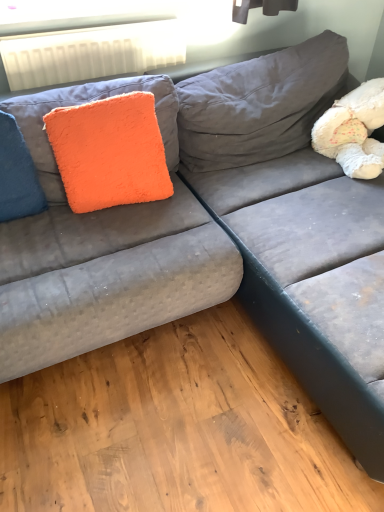
Question: From the image's perspective, is white fluffy teddy bear at upper right located above or below blue fuzzy pillow at left?

Choices:
 (A) above
 (B) below

Answer: (A)

Question: Is white fluffy teddy bear at upper right inside or outside of blue fuzzy pillow at left?

Choices:
 (A) outside
 (B) inside

Answer: (A)

Question: Estimate the real-world distances between objects in this image. Which object is closer to the white plastic radiator at upper left?

Choices:
 (A) blue fuzzy pillow at left
 (B) white fluffy teddy bear at upper right
 (C) orange fluffy pillow at upper left

Answer: (C)

Question: Which of these objects is positioned closest to the orange fluffy pillow at upper left?

Choices:
 (A) white fluffy teddy bear at upper right
 (B) blue fuzzy pillow at left
 (C) white plastic radiator at upper left

Answer: (B)